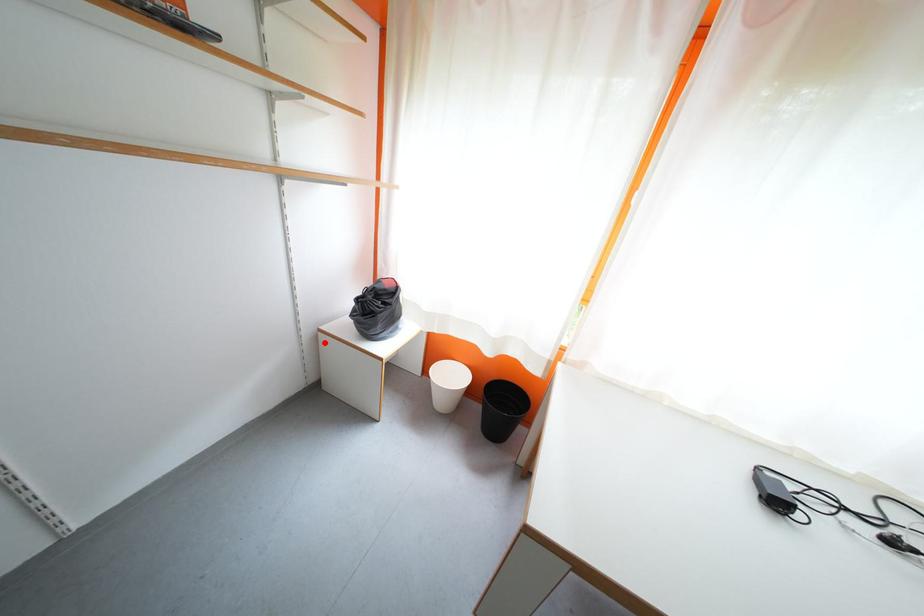
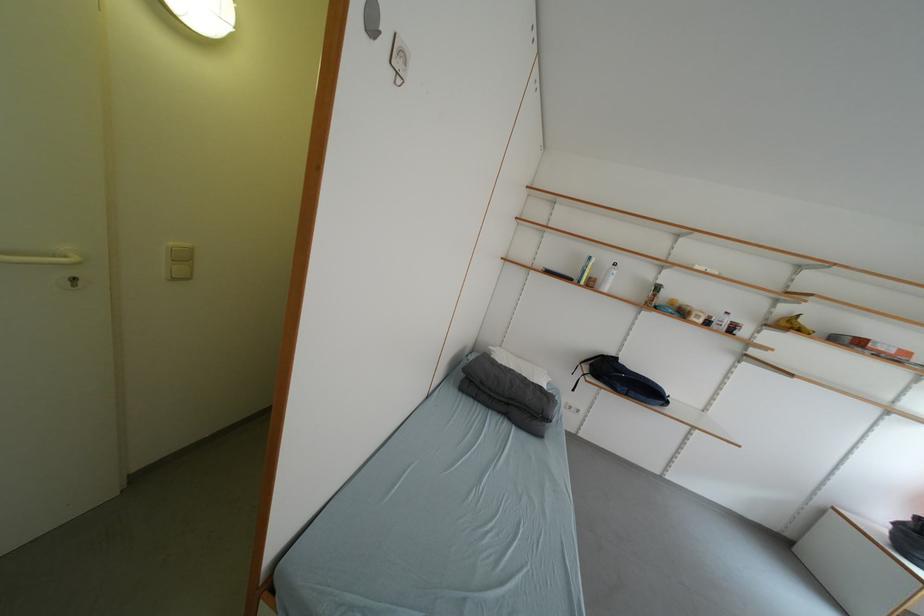
The point at the highlighted location is marked in the first image. Where is the corresponding point in the second image?

(832, 515)